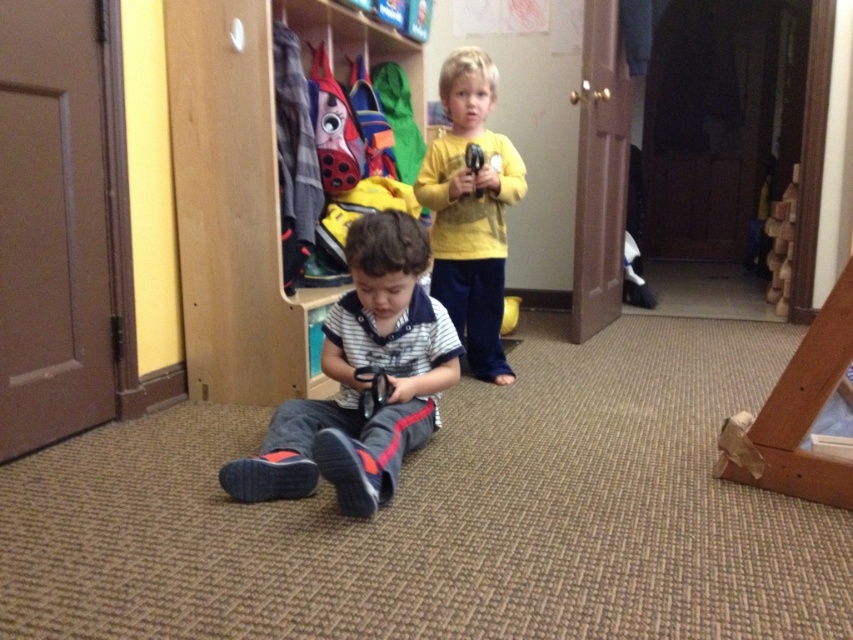
Can you confirm if wooden at center is bigger than striped cotton shirt at center?

Actually, wooden at center might be smaller than striped cotton shirt at center.

Between wooden at center and striped cotton shirt at center, which one is positioned lower?

striped cotton shirt at center

Measure the distance between wooden at center and camera.

The distance of wooden at center from camera is 2.15 meters.

Find the location of a particular element. This screenshot has width=853, height=640. wooden at center is located at coordinates (247, 188).

Who is higher up, wooden at center or yellow matte shirt at upper center?

wooden at center

Who is lower down, wooden at center or yellow matte shirt at upper center?

yellow matte shirt at upper center is below.

What do you see at coordinates (247, 188) in the screenshot?
I see `wooden at center` at bounding box center [247, 188].

This screenshot has width=853, height=640. Identify the location of wooden at center. (247, 188).

Between striped cotton shirt at center and yellow matte shirt at upper center, which one is positioned lower?

Positioned lower is striped cotton shirt at center.

Who is more forward, (x=357, y=344) or (x=451, y=284)?

Point (x=357, y=344) is more forward.

This screenshot has width=853, height=640. I want to click on striped cotton shirt at center, so click(x=361, y=380).